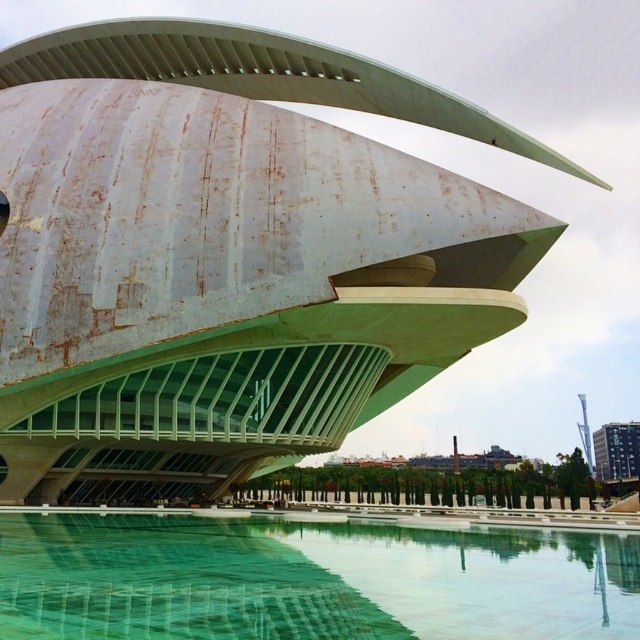
Question: Which object is farther from the camera taking this photo?

Choices:
 (A) green mosaic tiles at lower center
 (B) white matte building at center

Answer: (B)

Question: Does white matte building at center appear over green mosaic tiles at lower center?

Choices:
 (A) yes
 (B) no

Answer: (A)

Question: Among these points, which one is nearest to the camera?

Choices:
 (A) (493, 602)
 (B) (371, 369)

Answer: (A)

Question: Which point is closer to the camera taking this photo?

Choices:
 (A) (396, 580)
 (B) (168, 408)

Answer: (A)

Question: Does white matte building at center come in front of green mosaic tiles at lower center?

Choices:
 (A) yes
 (B) no

Answer: (B)

Question: Is white matte building at center below green mosaic tiles at lower center?

Choices:
 (A) no
 (B) yes

Answer: (A)